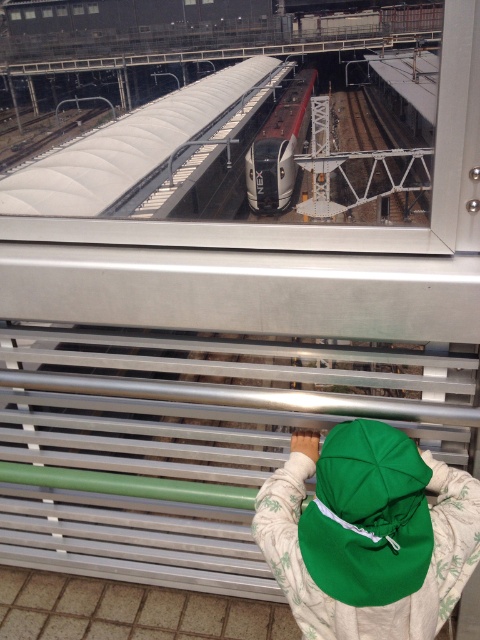
Which is above, green fabric cap at lower center or silver metallic train at center?

silver metallic train at center

Measure the distance from green fabric cap at lower center to silver metallic train at center.

green fabric cap at lower center is 80.46 feet from silver metallic train at center.

Does point (384, 593) come in front of point (278, 141)?

Yes, point (384, 593) is closer to viewer.

The height and width of the screenshot is (640, 480). I want to click on green fabric cap at lower center, so click(368, 534).